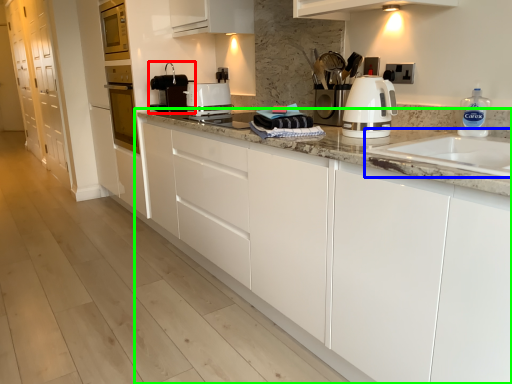
Question: Estimate the real-world distances between objects in this image. Which object is closer to home appliance (highlighted by a red box), sink (highlighted by a blue box) or cabinetry (highlighted by a green box)?

Choices:
 (A) sink
 (B) cabinetry

Answer: (B)